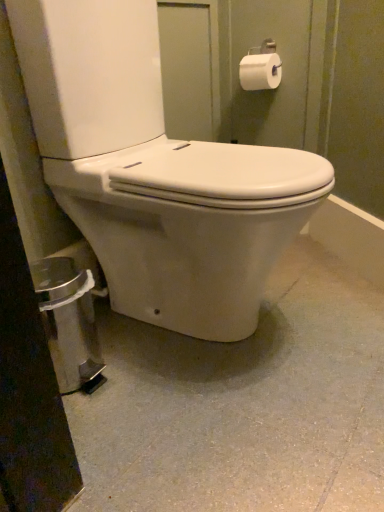
Question: Considering the relative sizes of white smooth concrete at center and white glossy toilet at center in the image provided, is white smooth concrete at center smaller than white glossy toilet at center?

Choices:
 (A) no
 (B) yes

Answer: (B)

Question: From the image's perspective, is white smooth concrete at center under white glossy toilet at center?

Choices:
 (A) yes
 (B) no

Answer: (A)

Question: From a real-world perspective, is white smooth concrete at center over white glossy toilet at center?

Choices:
 (A) yes
 (B) no

Answer: (B)

Question: Is white smooth concrete at center thinner than white glossy toilet at center?

Choices:
 (A) no
 (B) yes

Answer: (A)

Question: Is white smooth concrete at center looking in the opposite direction of white glossy toilet at center?

Choices:
 (A) yes
 (B) no

Answer: (B)

Question: Is white smooth concrete at center shorter than white glossy toilet at center?

Choices:
 (A) no
 (B) yes

Answer: (B)

Question: Does white glossy toilet at center turn towards white smooth concrete at center?

Choices:
 (A) no
 (B) yes

Answer: (A)

Question: Is white glossy toilet at center positioned with its back to white smooth concrete at center?

Choices:
 (A) yes
 (B) no

Answer: (B)

Question: Can you confirm if white glossy toilet at center is wider than white smooth concrete at center?

Choices:
 (A) no
 (B) yes

Answer: (A)

Question: Is white glossy toilet at center to the right of white smooth concrete at center from the viewer's perspective?

Choices:
 (A) yes
 (B) no

Answer: (B)

Question: Is white smooth concrete at center located within white glossy toilet at center?

Choices:
 (A) no
 (B) yes

Answer: (A)

Question: Does white glossy toilet at center touch white smooth concrete at center?

Choices:
 (A) yes
 (B) no

Answer: (B)

Question: Is white smooth concrete at center far from white matte toilet paper at upper right?

Choices:
 (A) yes
 (B) no

Answer: (A)